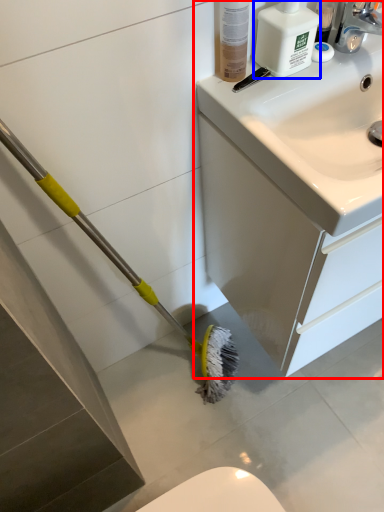
Question: Which object appears farthest to the camera in this image, bathroom cabinet (highlighted by a red box) or cleaning product (highlighted by a blue box)?

Choices:
 (A) bathroom cabinet
 (B) cleaning product

Answer: (B)